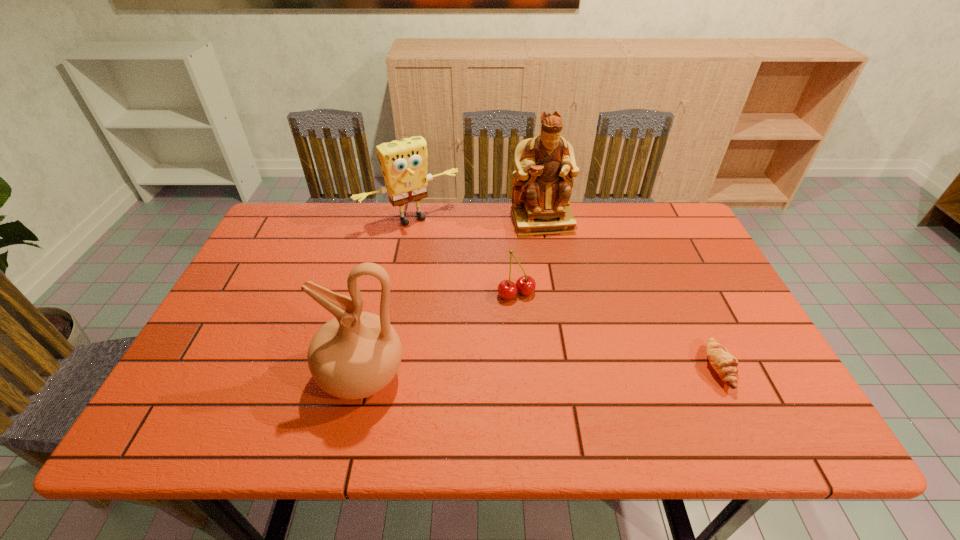
Locate an element on the screen. The height and width of the screenshot is (540, 960). free space at the far right corner of the desktop is located at coordinates (674, 222).

Identify the location of vacant area at the near right corner. The image size is (960, 540). (706, 370).

Find the location of a particular element. The image size is (960, 540). unoccupied area between the third farthest object and the sponge is located at coordinates (464, 256).

This screenshot has width=960, height=540. I want to click on vacant space that's between the second shortest object and the figurine, so click(x=529, y=258).

Identify the location of free space between the shortest object and the pottery. (540, 372).

Identify the location of vacant region between the sponge and the shortest object. The image size is (960, 540). (565, 293).

Find the location of a particular element. Image resolution: width=960 pixels, height=540 pixels. empty space that is in between the shortest object and the pottery is located at coordinates (540, 372).

The height and width of the screenshot is (540, 960). Identify the location of free space between the rightmost object and the third tallest object. (565, 293).

At what (x,y) coordinates should I click in order to perform the action: click on free space between the figurine and the pottery. Please return your answer as a coordinate pair (x, y). This screenshot has height=540, width=960. Looking at the image, I should click on (452, 299).

Locate an element on the screen. The image size is (960, 540). object identified as the third closest to the sponge is located at coordinates (356, 354).